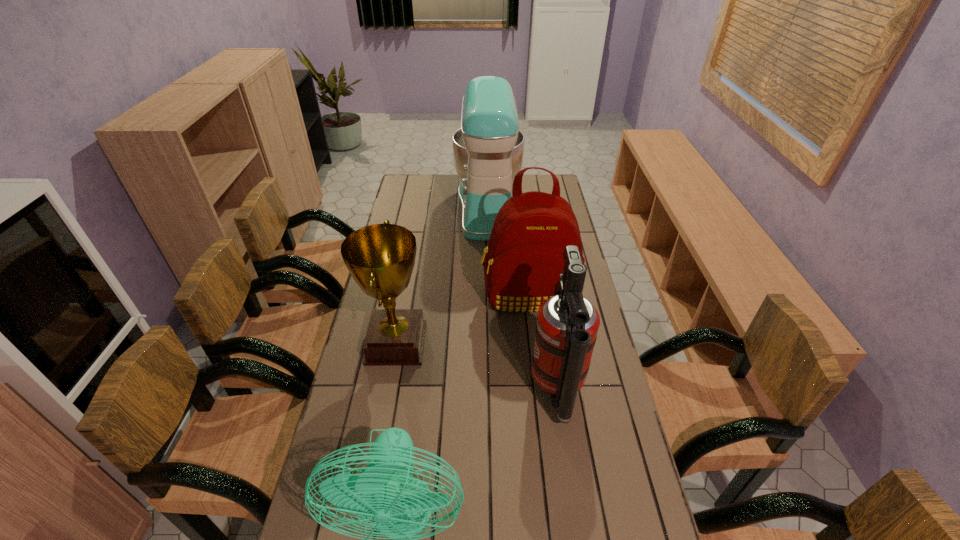
Find the location of a particular element. This screenshot has height=540, width=960. vacant region located 0.400m on the front label side of the fire extinguisher is located at coordinates (393, 391).

Identify the location of vacant space located 0.200m on the plaque of the award. (490, 343).

Where is `object present at the far edge`? This screenshot has width=960, height=540. object present at the far edge is located at coordinates (488, 149).

Locate an element on the screen. object situated at the left edge is located at coordinates (380, 257).

In order to click on backpack positioned at the right edge in this screenshot , I will do 524,258.

Where is `fire extinguisher that is at the right edge`? The width and height of the screenshot is (960, 540). fire extinguisher that is at the right edge is located at coordinates (567, 325).

You are a GUI agent. You are given a task and a screenshot of the screen. Output one action in this format:
    pyautogui.click(x=<x>, y=<y>)
    Task: Click on the free region at the far edge of the desktop
    This screenshot has width=960, height=540.
    Given the screenshot: What is the action you would take?
    pyautogui.click(x=437, y=188)

Identify the location of vacant area at the left edge of the desktop. (418, 231).

Locate an element on the screen. This screenshot has width=960, height=540. free space at the right edge is located at coordinates (586, 416).

In order to click on blank space at the far left corner of the desktop in this screenshot , I will do `click(429, 180)`.